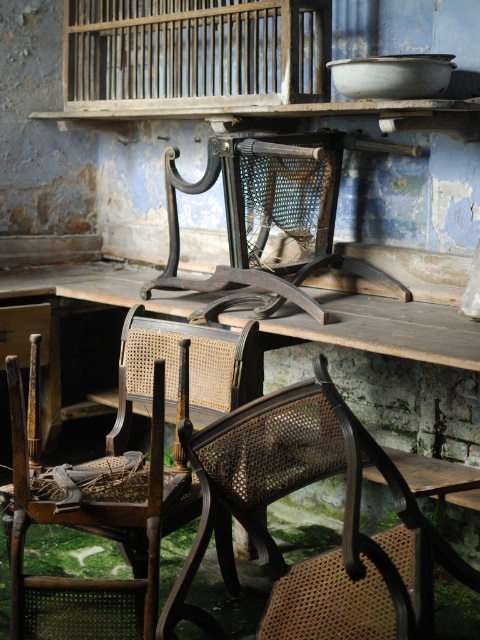
You are standing in the old house and see the wooden cage at upper center and the woven cane chair at center. Which object is located to the right of the other?

The wooden cage at upper center is positioned on the right side of woven cane chair at center.

You are standing in the room and want to place a small potted plant between the brown cane chair at center and the woven wood birdcage at center. Based on their positions, which object should the plant be closer to?

The brown cane chair at center is in front of the woven wood birdcage at center, so the plant should be placed closer to the woven wood birdcage at center to maintain the spatial arrangement.